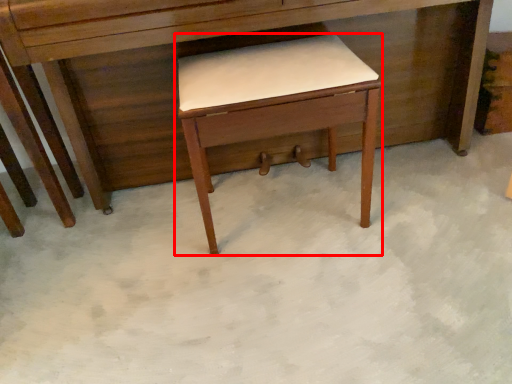
Question: From the image's perspective, considering the relative positions of table (annotated by the red box) and desk in the image provided, where is table (annotated by the red box) located with respect to the staircase?

Choices:
 (A) above
 (B) below

Answer: (B)